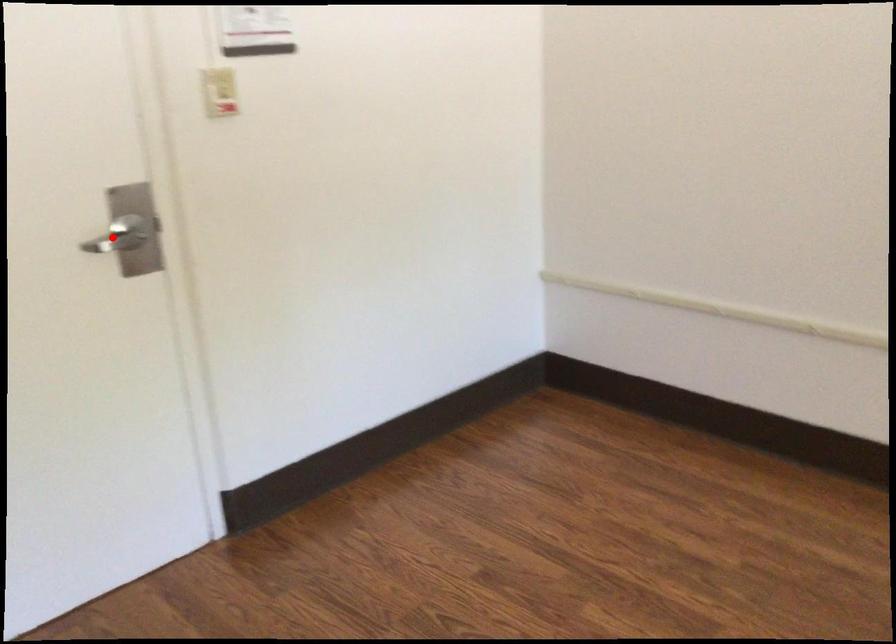
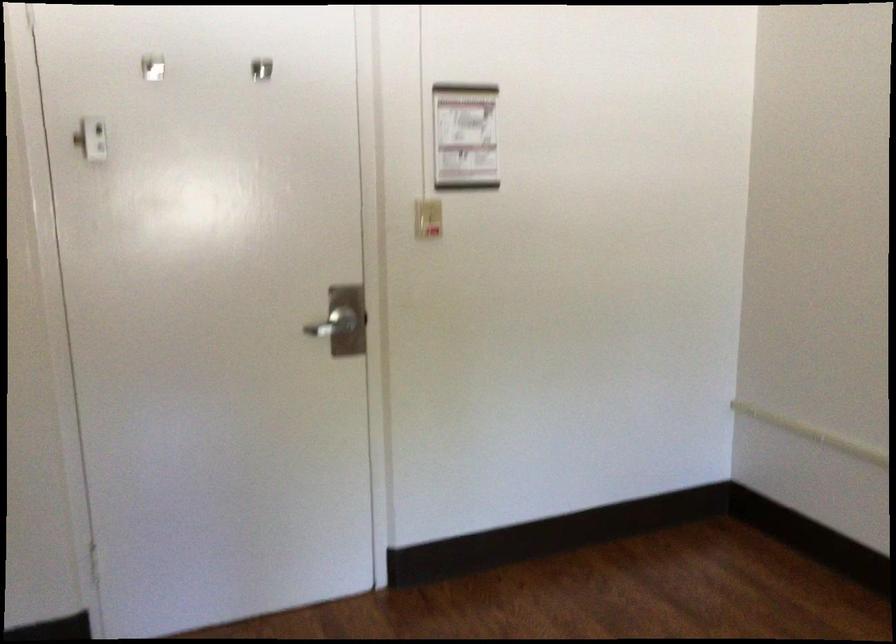
Question: I am providing you with two images of the same scene from different viewpoints. A red point is shown in image1. For the corresponding object point in image2, is it positioned nearer or farther from the camera?

Choices:
 (A) Nearer
 (B) Farther

Answer: (B)